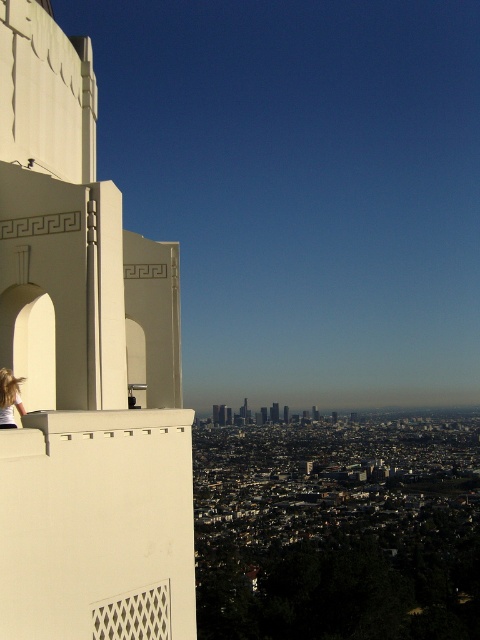
Question: Is white concrete tower at left behind matte white skyscraper at center?

Choices:
 (A) no
 (B) yes

Answer: (A)

Question: Which point appears farthest from the camera in this image?

Choices:
 (A) [12, 388]
 (B) [165, 461]
 (C) [271, 412]

Answer: (B)

Question: Is white concrete tower at left positioned behind matte white skyscraper at center?

Choices:
 (A) yes
 (B) no

Answer: (B)

Question: Which of the following is the farthest from the observer?

Choices:
 (A) matte white skyscraper at center
 (B) white concrete tower at left
 (C) blonde hair at left

Answer: (A)

Question: Which point is farther to the camera?

Choices:
 (A) (186, 449)
 (B) (0, 396)

Answer: (A)

Question: Can you confirm if white concrete tower at left is thinner than blonde hair at left?

Choices:
 (A) no
 (B) yes

Answer: (A)